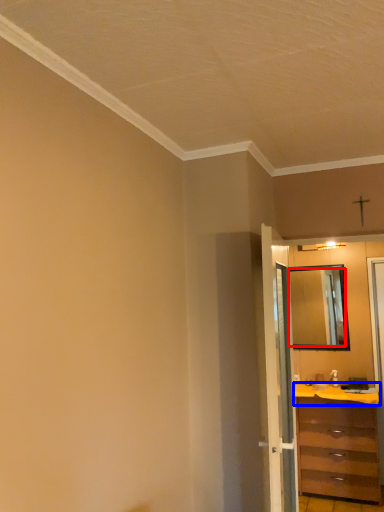
Question: Which object is closer to the camera taking this photo, mirror (highlighted by a red box) or counter top (highlighted by a blue box)?

Choices:
 (A) mirror
 (B) counter top

Answer: (B)